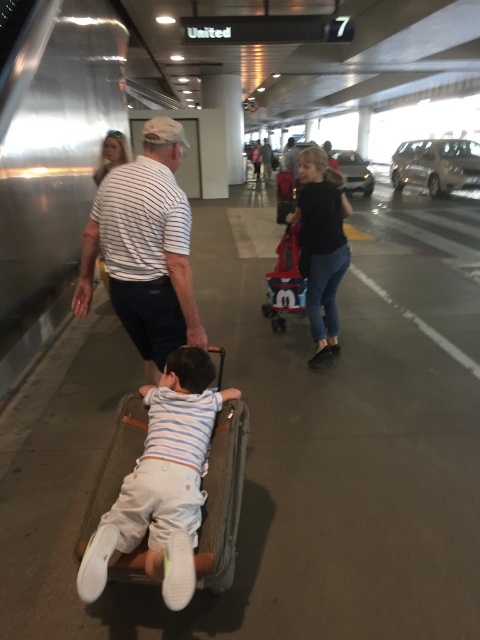
Is light blue striped shirt at center thinner than white striped shirt at center?

Yes.

Who is more distant from viewer, (212, 442) or (126, 292)?

The point (126, 292) is more distant.

Is point (184, 355) positioned after point (171, 316)?

No.

This screenshot has width=480, height=640. I want to click on light blue striped shirt at center, so click(168, 481).